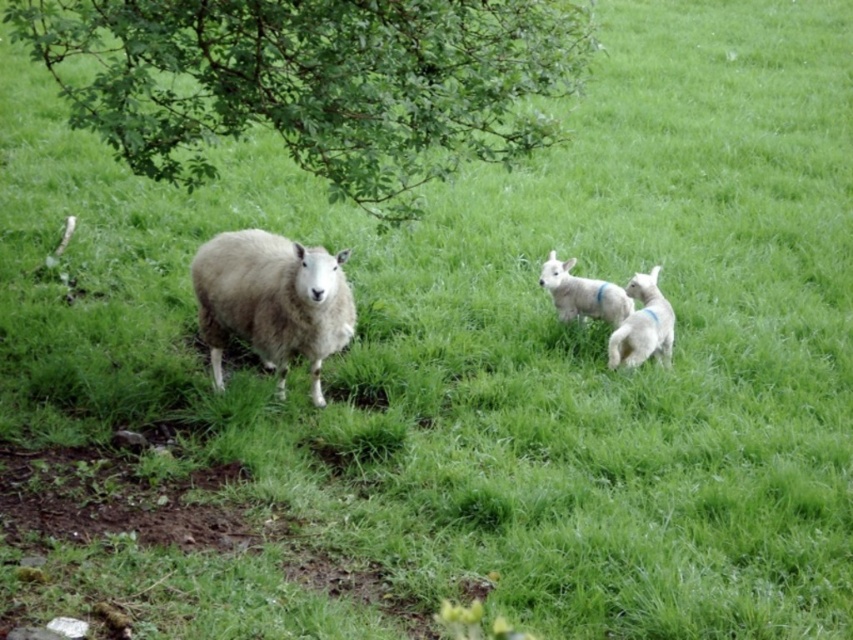
How distant is green leafy tree at upper left from white woolly sheep at center?

The distance of green leafy tree at upper left from white woolly sheep at center is 27.60 inches.

Looking at this image, can you confirm if green leafy tree at upper left is taller than white woolly sheep at center?

Correct, green leafy tree at upper left is much taller as white woolly sheep at center.

Find the location of a particular element. The image size is (853, 640). green leafy tree at upper left is located at coordinates (312, 83).

Is green leafy tree at upper left behind white woolen lamb at right?

No.

Does green leafy tree at upper left lie in front of white woolen lamb at right?

Yes, it is in front of white woolen lamb at right.

Describe the element at coordinates (312, 83) in the screenshot. I see `green leafy tree at upper left` at that location.

This screenshot has width=853, height=640. I want to click on green leafy tree at upper left, so click(x=312, y=83).

Can you confirm if white woolly sheep at center is bigger than white woolen lamb at right?

Correct, white woolly sheep at center is larger in size than white woolen lamb at right.

Is white woolly sheep at center above white woolen lamb at right?

Incorrect, white woolly sheep at center is not positioned above white woolen lamb at right.

Is point (259, 353) less distant than point (668, 307)?

Yes, it is.

Find the location of a particular element. The height and width of the screenshot is (640, 853). white woolly sheep at center is located at coordinates (271, 301).